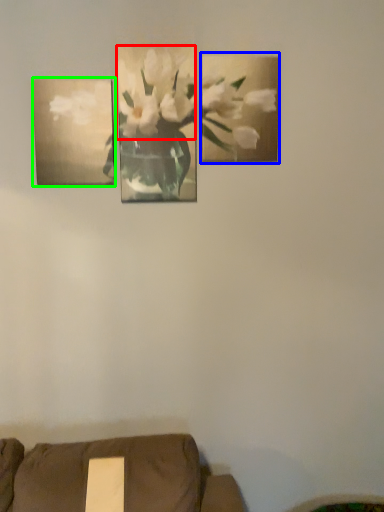
Question: Which object is the closest to the flower (highlighted by a red box)? Choose among these: picture frame (highlighted by a blue box) or picture frame (highlighted by a green box).

Choices:
 (A) picture frame
 (B) picture frame

Answer: (A)